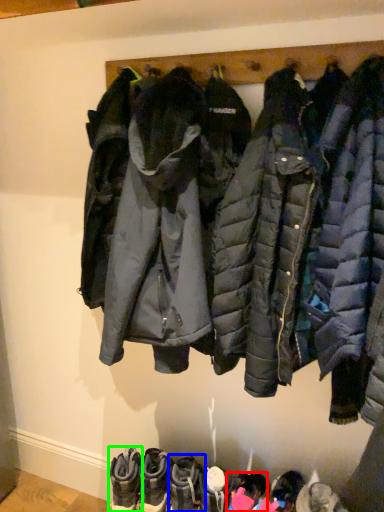
Question: Which is nearer to the footwear (highlighted by a red box)? footwear (highlighted by a blue box) or footwear (highlighted by a green box).

Choices:
 (A) footwear
 (B) footwear

Answer: (A)